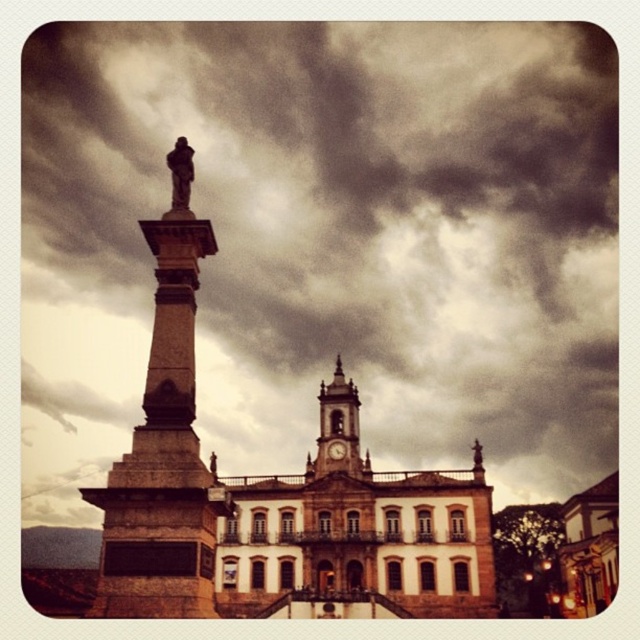
Looking at this image, does brown stone obelisk at left have a greater height compared to bronze statue at center?

Indeed, brown stone obelisk at left has a greater height compared to bronze statue at center.

Who is taller, brown stone obelisk at left or bronze statue at center?

brown stone obelisk at left is taller.

Does point (152, 518) come closer to viewer compared to point (180, 195)?

Yes.

Image resolution: width=640 pixels, height=640 pixels. I want to click on brown stone obelisk at left, so 163,458.

Who is lower down, brown stone obelisk at left or golden stone clock tower at center?

golden stone clock tower at center is lower down.

Can you confirm if brown stone obelisk at left is smaller than golden stone clock tower at center?

Actually, brown stone obelisk at left might be larger than golden stone clock tower at center.

Does point (166, 237) come behind point (340, 417)?

No, it is not.

You are a GUI agent. You are given a task and a screenshot of the screen. Output one action in this format:
    pyautogui.click(x=<x>, y=<y>)
    Task: Click on the brown stone obelisk at left
    Image resolution: width=640 pixels, height=640 pixels.
    Given the screenshot: What is the action you would take?
    pyautogui.click(x=163, y=458)

Can you confirm if golden stone clock tower at center is bigger than bronze statue at center?

Actually, golden stone clock tower at center might be smaller than bronze statue at center.

At what (x,y) coordinates should I click in order to perform the action: click on golden stone clock tower at center. Please return your answer as a coordinate pair (x, y). The width and height of the screenshot is (640, 640). Looking at the image, I should click on (337, 429).